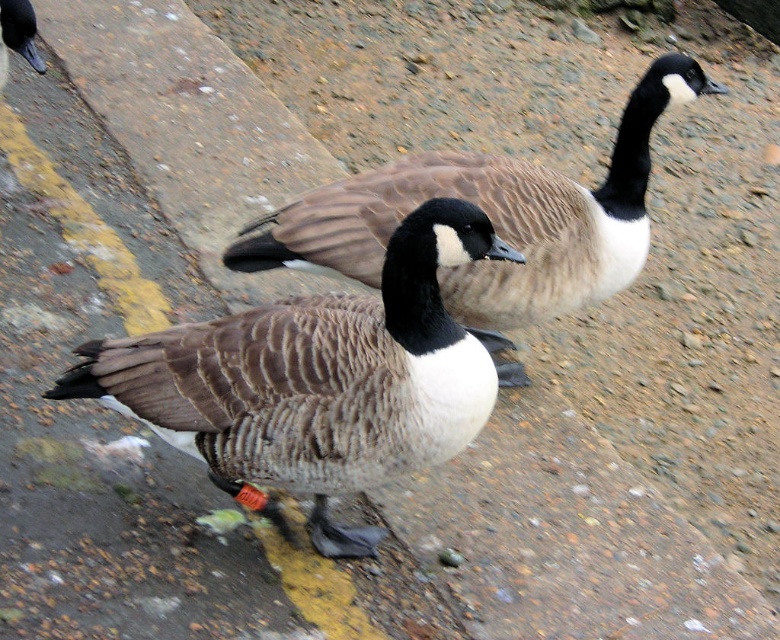
Question: Does brown textured duck at center have a greater width compared to brown textured goose at center?

Choices:
 (A) no
 (B) yes

Answer: (A)

Question: Which object appears closest to the camera in this image?

Choices:
 (A) brown feathered duck at upper left
 (B) brown textured duck at center

Answer: (B)

Question: Which point appears farthest from the camera in this image?

Choices:
 (A) (0, 49)
 (B) (195, 400)
 (C) (624, 202)

Answer: (A)

Question: Which of these objects is positioned closest to the brown feathered duck at upper left?

Choices:
 (A) brown textured duck at center
 (B) brown textured goose at center

Answer: (B)

Question: Does brown textured duck at center come in front of brown feathered duck at upper left?

Choices:
 (A) yes
 (B) no

Answer: (A)

Question: Can you confirm if brown textured duck at center is positioned to the right of brown textured goose at center?

Choices:
 (A) no
 (B) yes

Answer: (A)